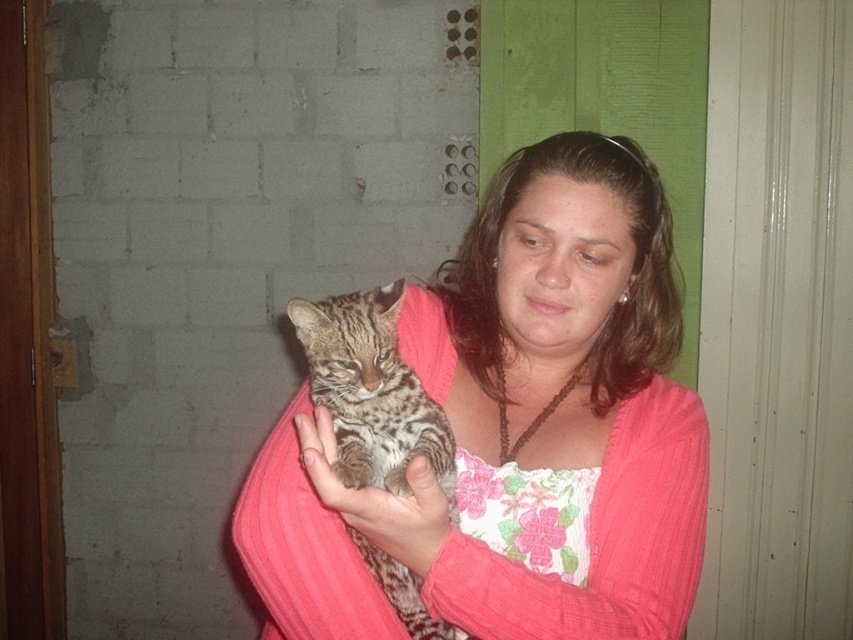
In the scene shown: You are a photographer trying to capture a portrait of the woman in the pink ribbed sweater at center. The camera you are using has a minimum focusing distance of 70 centimeters. Can you take the photo without moving either the camera or the woman?

The pink ribbed sweater at center and camera are 73.64 centimeters apart from each other. Since the minimum focusing distance is 70 centimeters, the photographer can take the photo without moving either the camera or the woman because the distance is within the camera

What are the coordinates of the pink ribbed sweater at center?

The pink ribbed sweater at center is located at coordinates point (515,429).

The woman is holding the fluffy fur cat at center and wearing the pink ribbed sweater at center. Which item is positioned to the right side of the other?

The pink ribbed sweater at center is to the right of the fluffy fur cat at center.